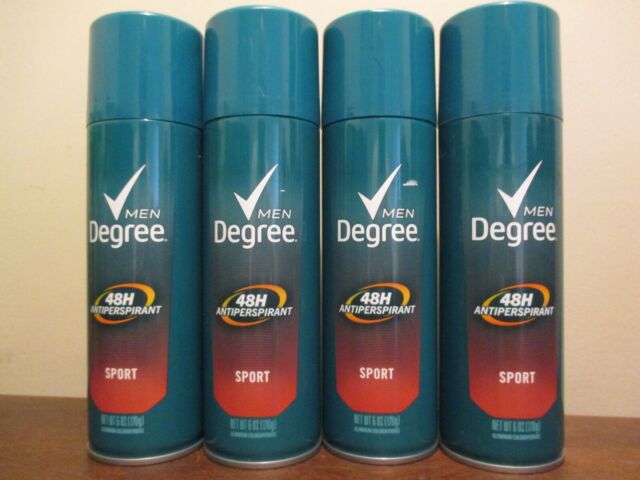
The width and height of the screenshot is (640, 480). In order to click on tabletop in this screenshot , I will do `click(35, 466)`.